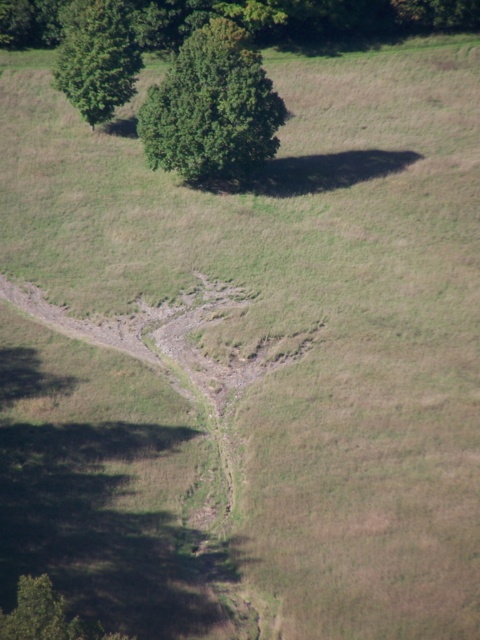
Question: Which point is farther to the camera?

Choices:
 (A) (84, 97)
 (B) (208, 72)

Answer: (A)

Question: Can you confirm if green matte tree at upper center is thinner than green leafy tree at upper left?

Choices:
 (A) yes
 (B) no

Answer: (B)

Question: Which point appears closest to the camera in this image?

Choices:
 (A) (57, 74)
 (B) (192, 154)

Answer: (B)

Question: Can you confirm if green matte tree at upper center is positioned to the left of green leafy tree at upper left?

Choices:
 (A) no
 (B) yes

Answer: (A)

Question: Is green matte tree at upper center bigger than green leafy tree at upper left?

Choices:
 (A) yes
 (B) no

Answer: (A)

Question: Among these points, which one is farthest from the camera?

Choices:
 (A) (167, 90)
 (B) (129, 35)

Answer: (B)